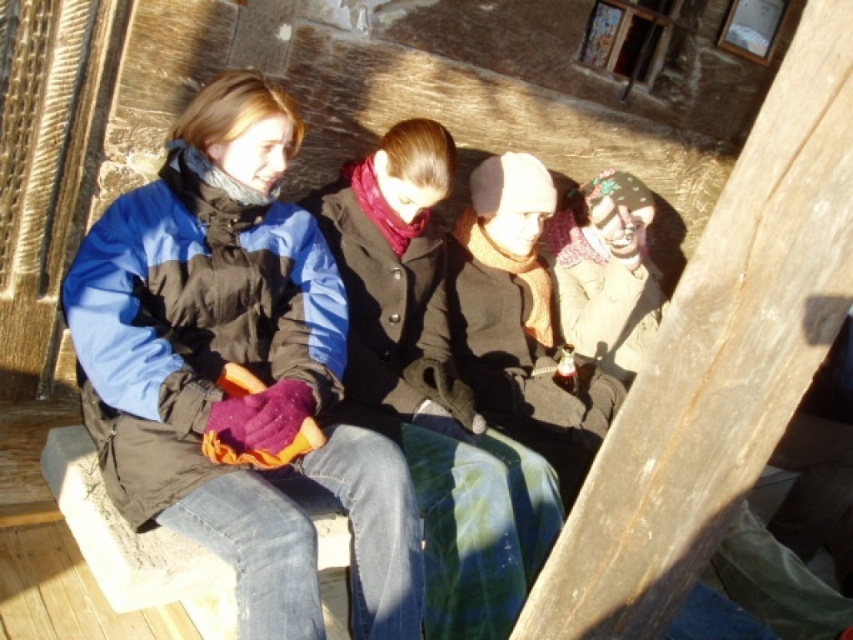
You are standing at the point labeled as point (91, 320) and want to walk to the cabin entrance located 2.68 meters away. Is the cabin entrance in front of you or behind you?

The cabin entrance is 2.68 meters away from point (91, 320), so it is in front of you.